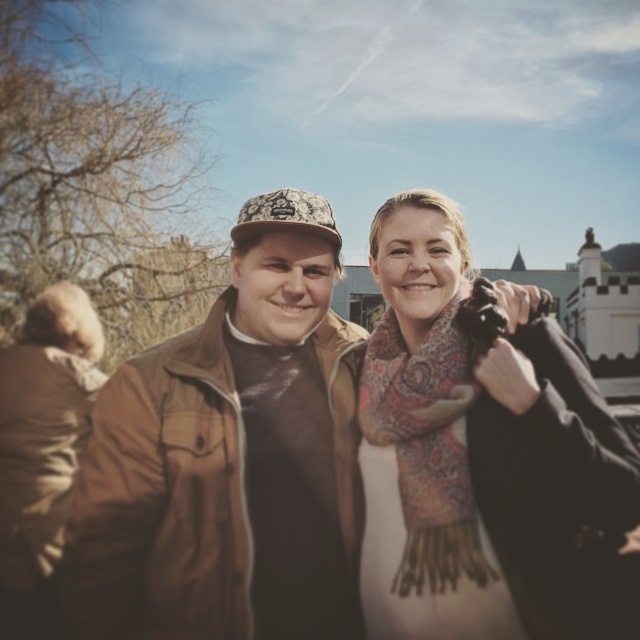
Question: Does brown leather jacket at center have a lesser width compared to patterned wool scarf at center?

Choices:
 (A) yes
 (B) no

Answer: (B)

Question: Can you confirm if brown leather jacket at center is bigger than patterned wool scarf at center?

Choices:
 (A) no
 (B) yes

Answer: (B)

Question: Which point is farther to the camera?

Choices:
 (A) (424, 280)
 (B) (248, 493)
 (C) (420, 538)

Answer: (A)

Question: Which point appears farthest from the camera in this image?

Choices:
 (A) (x=461, y=552)
 (B) (x=518, y=344)

Answer: (B)

Question: Which point is farther to the camera?

Choices:
 (A) brown leather jacket at center
 (B) patterned wool scarf at center
 (C) patterned scarf at center

Answer: (B)

Question: Is brown leather jacket at center closer to the viewer compared to patterned scarf at center?

Choices:
 (A) yes
 (B) no

Answer: (B)